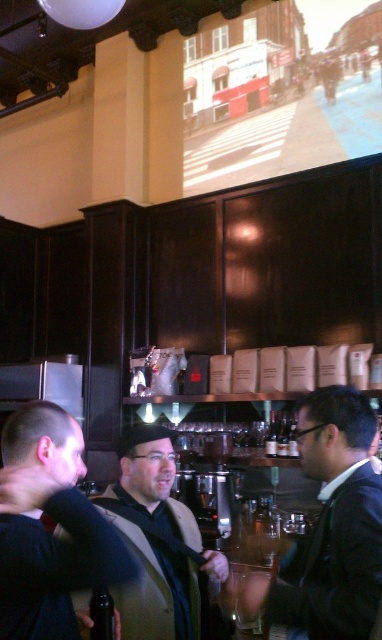
You are a photographer trying to capture a candid shot of the person in the dark gray suit at center without including the dark blue sweater at center in the frame. Is this possible given their current positions?

The dark blue sweater at center is in front of the dark gray suit at center, so it would block the view. Therefore, capturing a clear shot of the dark gray suit at center without including the dark blue sweater at center is not possible with their current positioning.

You are a photographer positioned at the back of the coffee shop. You want to take a photo of the dark gray suit at center without the dark brown leather jacket at center blocking the view. Is this possible based on their current positions?

The dark brown leather jacket at center is in front of the dark gray suit at center, so it is blocking the view. Therefore, it is not possible to take a photo of the dark gray suit at center without the dark brown leather jacket at center blocking the view.

You are standing in the coffee shop and want to locate the dark brown leather jacket at center. According to the coordinates provided, where should you look?

The dark brown leather jacket at center is located at coordinates point (331,525).